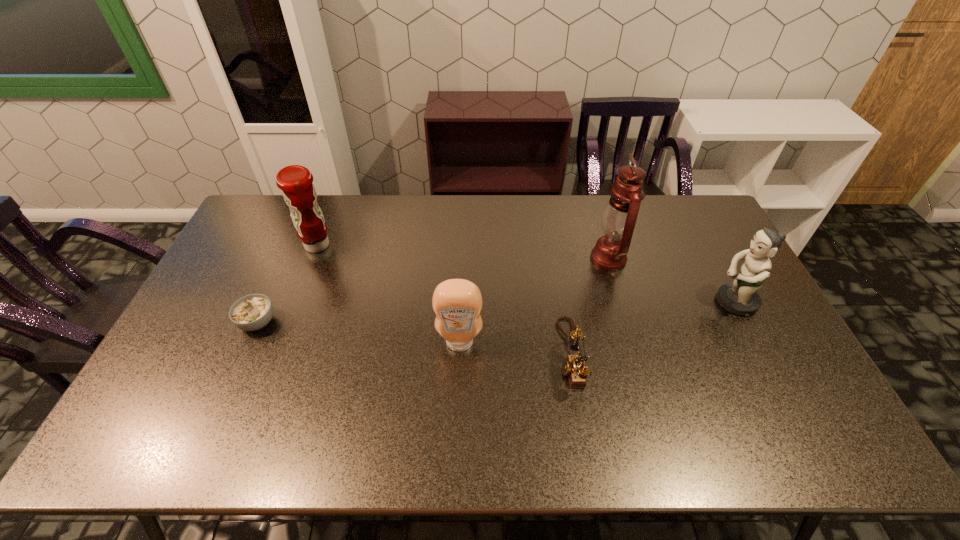
Find the location of a particular element. The image size is (960, 540). the fifth object from left to right is located at coordinates (619, 218).

Find the location of a particular element. The height and width of the screenshot is (540, 960). oil lamp is located at coordinates (619, 218).

At what (x,y) coordinates should I click in order to perform the action: click on the left condiment. Please return your answer as a coordinate pair (x, y). This screenshot has height=540, width=960. Looking at the image, I should click on (296, 182).

At what (x,y) coordinates should I click in order to perform the action: click on the taller condiment. Please return your answer as a coordinate pair (x, y). Looking at the image, I should click on (296, 182).

Locate an element on the screen. The image size is (960, 540). the rightmost object is located at coordinates (740, 297).

Image resolution: width=960 pixels, height=540 pixels. I want to click on the shorter condiment, so click(x=457, y=303).

Where is `the fourth object from right to left`? the fourth object from right to left is located at coordinates (457, 303).

This screenshot has width=960, height=540. I want to click on the third object from right to left, so click(575, 367).

This screenshot has height=540, width=960. What are the coordinates of `telephone` in the screenshot? It's located at (575, 367).

This screenshot has height=540, width=960. In order to click on the shortest object in this screenshot , I will do `click(252, 312)`.